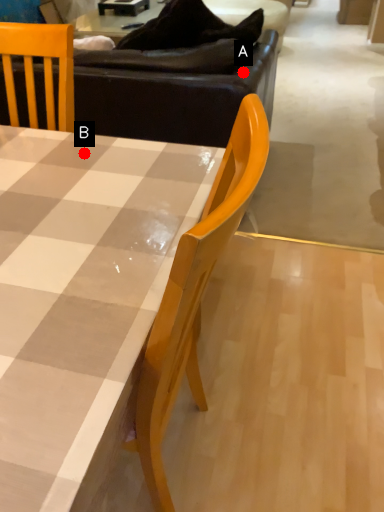
Question: Two points are circled on the image, labeled by A and B beside each circle. Which point is farther to the camera?

Choices:
 (A) A is further
 (B) B is further

Answer: (A)